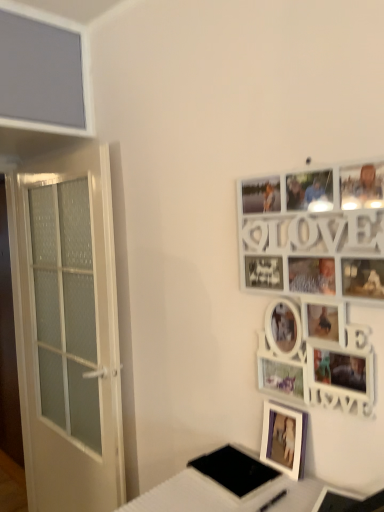
Question: From the image's perspective, is purple matte picture frame at lower right, the 1th picture frame from the bottom, located above white glossy table at lower right?

Choices:
 (A) yes
 (B) no

Answer: (A)

Question: Does purple matte picture frame at lower right, the 1th picture frame from the bottom, turn towards white glossy table at lower right?

Choices:
 (A) no
 (B) yes

Answer: (B)

Question: Is the position of purple matte picture frame at lower right, the 1th picture frame from the bottom, more distant than that of white glossy table at lower right?

Choices:
 (A) yes
 (B) no

Answer: (A)

Question: Is purple matte picture frame at lower right, the 1th picture frame from the bottom, positioned before white glossy table at lower right?

Choices:
 (A) no
 (B) yes

Answer: (A)

Question: Does purple matte picture frame at lower right, which is the 2th picture frame from top to bottom, have a smaller size compared to white glossy table at lower right?

Choices:
 (A) yes
 (B) no

Answer: (A)

Question: Considering the relative sizes of purple matte picture frame at lower right, the 1th picture frame from the bottom, and black matte pad at lower center in the image provided, is purple matte picture frame at lower right, the 1th picture frame from the bottom, taller than black matte pad at lower center?

Choices:
 (A) no
 (B) yes

Answer: (B)

Question: Can you confirm if purple matte picture frame at lower right, which is the 2th picture frame from top to bottom, is smaller than black matte pad at lower center?

Choices:
 (A) yes
 (B) no

Answer: (A)

Question: Are purple matte picture frame at lower right, which is the 2th picture frame from top to bottom, and black matte pad at lower center located far from each other?

Choices:
 (A) yes
 (B) no

Answer: (B)

Question: Can you confirm if purple matte picture frame at lower right, which is the 2th picture frame from top to bottom, is thinner than black matte pad at lower center?

Choices:
 (A) no
 (B) yes

Answer: (B)

Question: From a real-world perspective, is purple matte picture frame at lower right, the 1th picture frame from the bottom, under black matte pad at lower center?

Choices:
 (A) yes
 (B) no

Answer: (B)

Question: Is purple matte picture frame at lower right, the 1th picture frame from the bottom, wider than black matte pad at lower center?

Choices:
 (A) no
 (B) yes

Answer: (A)

Question: Would you say white frosted glass door at left contains white wooden picture frame at upper right, which appears as the second picture frame when ordered from the bottom?

Choices:
 (A) no
 (B) yes

Answer: (A)